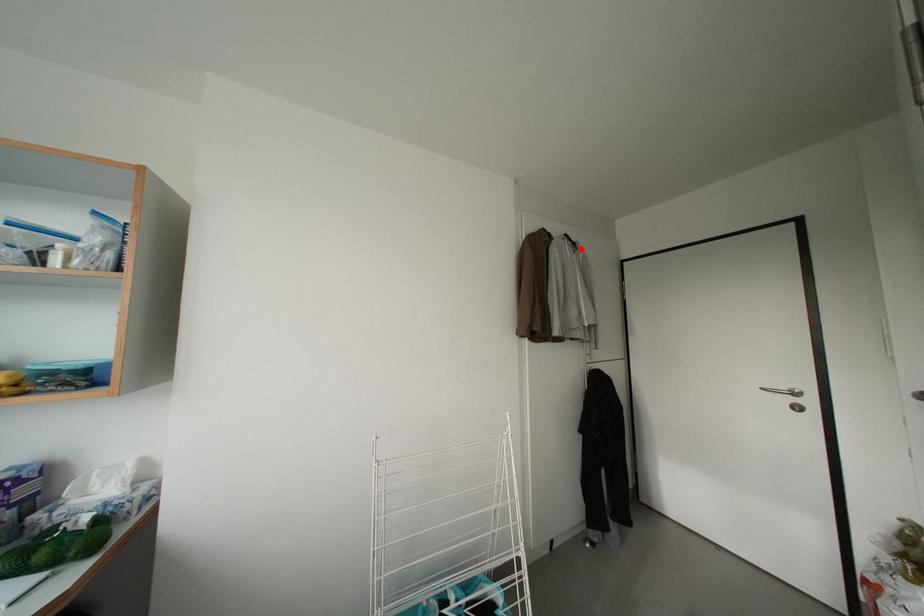
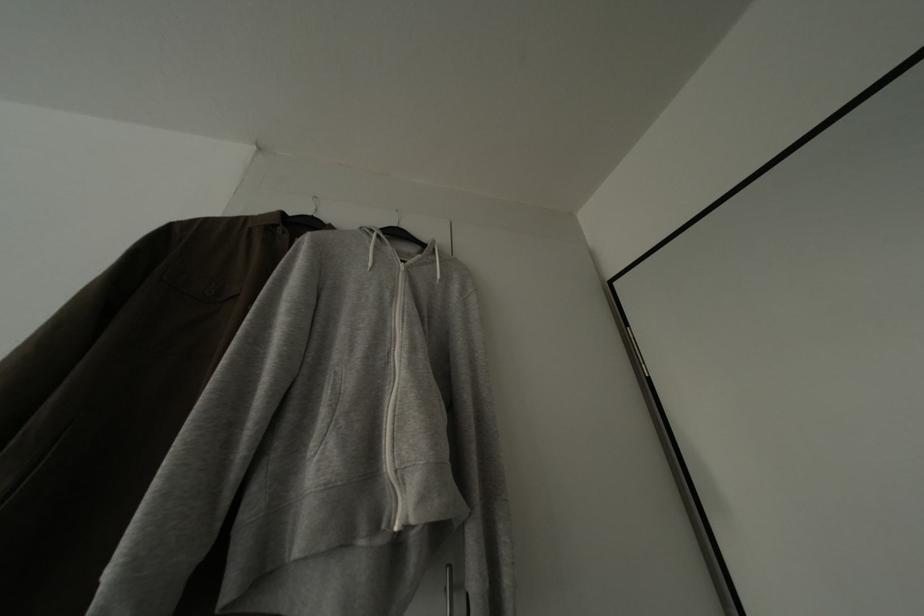
The point at the highlighted location is marked in the first image. Where is the corresponding point in the second image?

(431, 252)